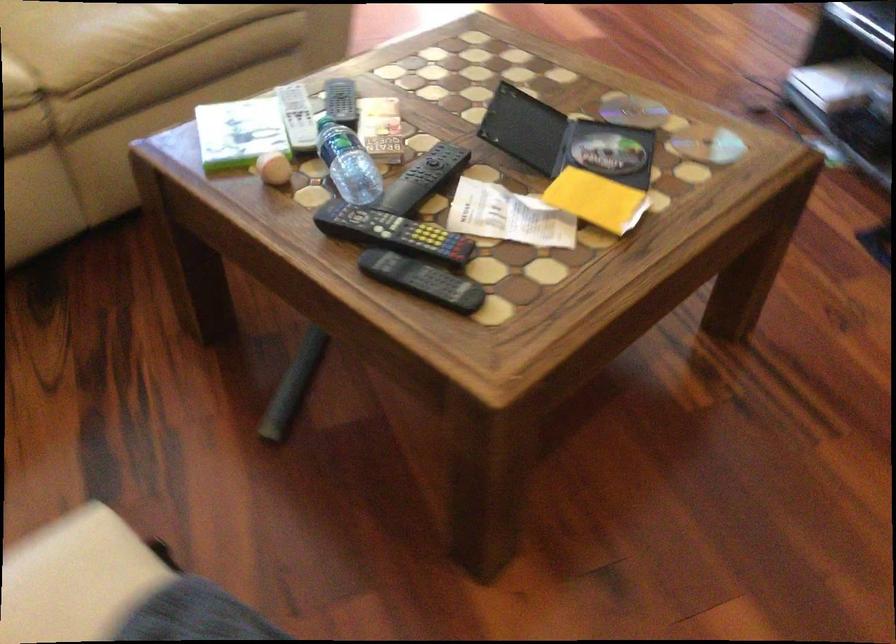
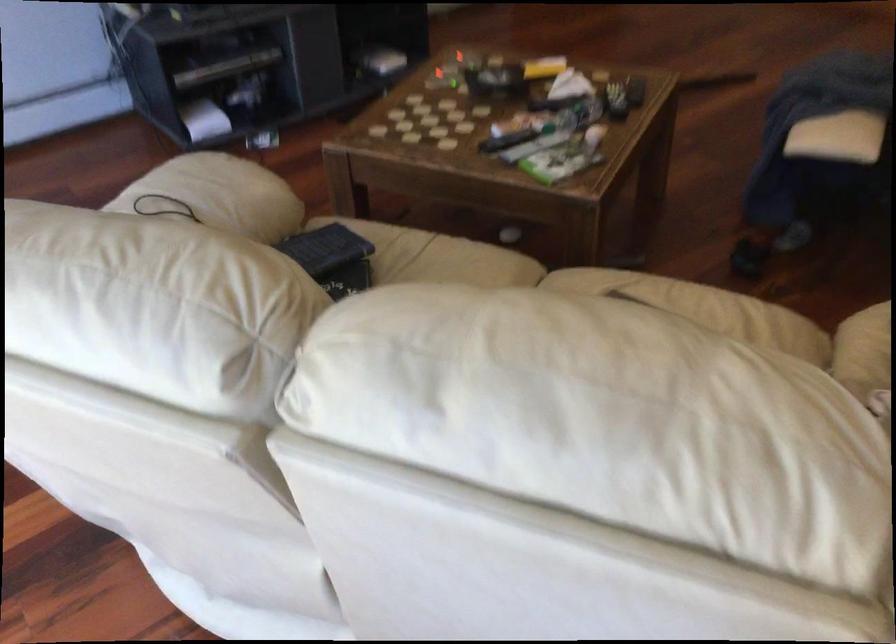
In the second image, find the point that corresponds to (x=322, y=99) in the first image.

(506, 140)